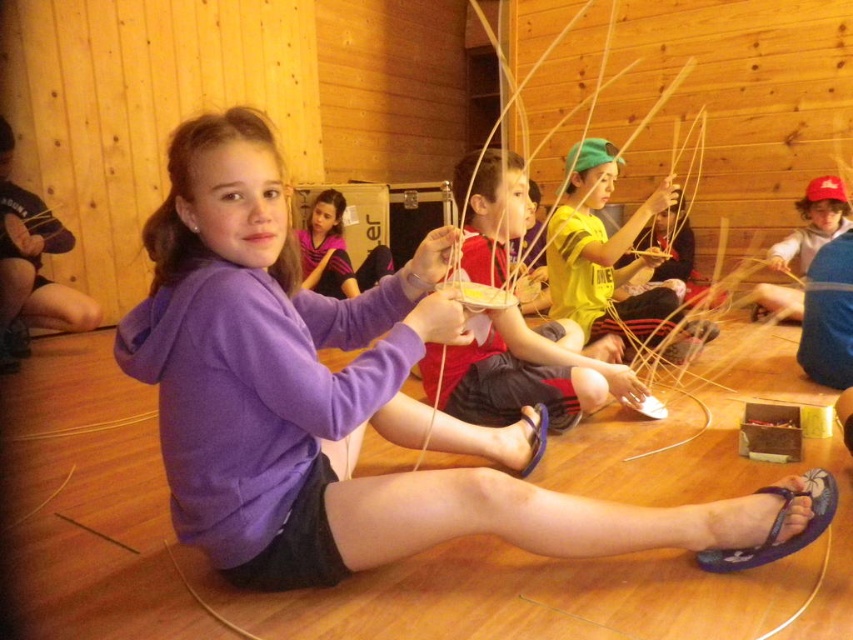
Question: Among these points, which one is nearest to the camera?

Choices:
 (A) pos(376,502)
 (B) pos(532,408)
 (C) pos(715,557)

Answer: (A)

Question: Is purple cotton hoodie at center smaller than yellow matte shirt at upper center?

Choices:
 (A) yes
 (B) no

Answer: (B)

Question: Does matte yellow shirt at center have a greater width compared to purple fabric sandal at lower center?

Choices:
 (A) no
 (B) yes

Answer: (B)

Question: Does matte yellow shirt at center have a lesser width compared to yellow matte shirt at upper center?

Choices:
 (A) yes
 (B) no

Answer: (A)

Question: Which of these objects is positioned closest to the matte blue hoodie at center?

Choices:
 (A) purple cotton hoodie at center
 (B) purple fabric sandal at lower center

Answer: (B)

Question: Among these objects, which one is farthest from the camera?

Choices:
 (A) matte yellow shirt at center
 (B) purple fabric sandal at lower center

Answer: (B)